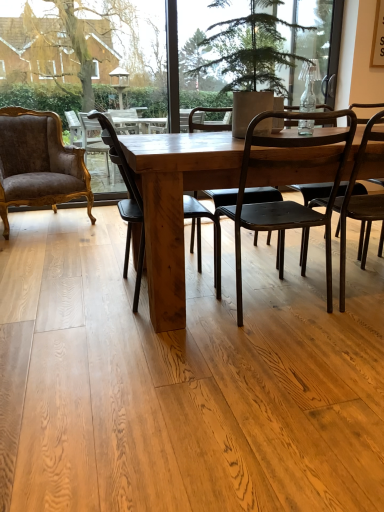
I want to click on unoccupied space behind matte black chair at center, acting as the 3th chair starting from the left, so click(x=265, y=264).